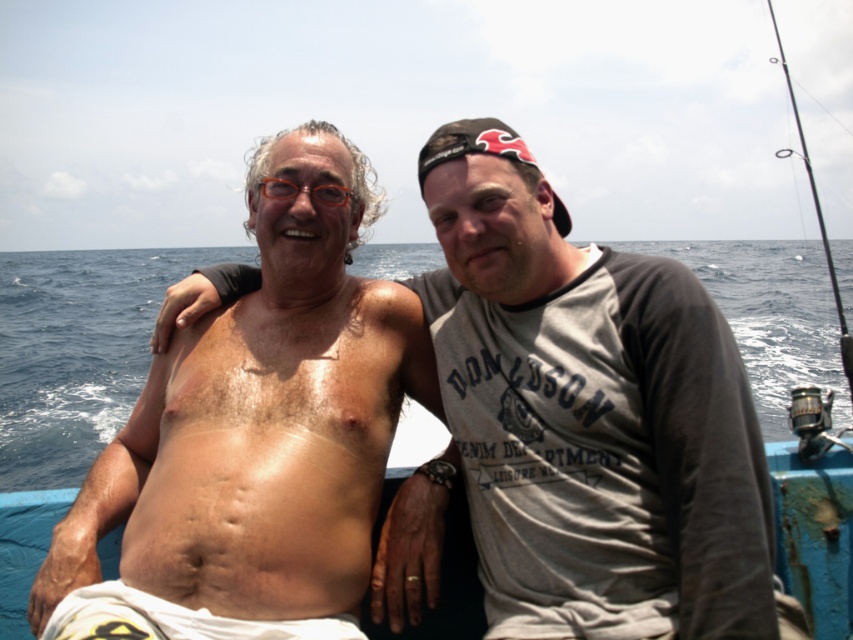
You are a photographer planning to take a photo of the skinny white man at center and the blue water at center. Which object should you focus on first if you want to capture both in a single shot without moving the camera?

The skinny white man at center has a smaller size compared to blue water at center, so you should focus on the blue water at center first to ensure both are in focus.

You are a photographer on a boat. You want to take a photo of the shiny skin torso at center and the blue water at center. Which object is closer to the camera lens?

The shiny skin torso at center is closer to the camera lens because it is positioned below the blue water at center, indicating it is in front of the water in the frame.

You are a photographer trying to capture a balanced composition. Given the scene with the shiny skin torso at center and blue water at center, which object should you focus on to ensure the larger portion of your photo includes the dominant element?

The blue water at center occupies more space than the shiny skin torso at center, so focusing on the blue water at center would ensure the larger portion of your photo includes the dominant element.